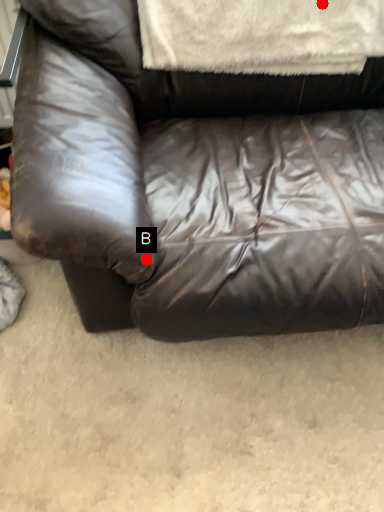
Question: Two points are circled on the image, labeled by A and B beside each circle. Which point is closer to the camera?

Choices:
 (A) A is closer
 (B) B is closer

Answer: (B)